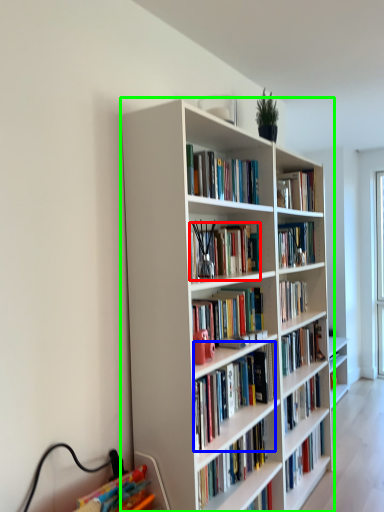
Question: Which object is the farthest from book (highlighted by a red box)? Choose among these: book (highlighted by a blue box) or bookcase (highlighted by a green box).

Choices:
 (A) book
 (B) bookcase

Answer: (A)